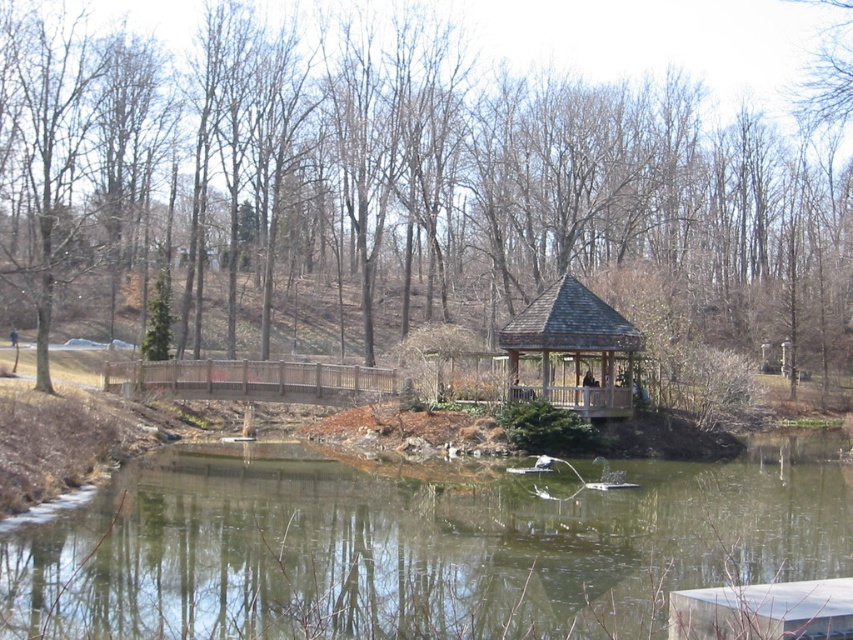
You are standing at the edge of the pond and want to take a photo of the green leafy tree at center. Based on its 2D location, where should you position yourself to capture the tree in the center of your camera frame?

The green leafy tree at center is located at point 0.292 on the x axis and 0.471 on the y axis, so you should position yourself at the edge of the pond facing towards the coordinates (401, 186) to center the tree in your camera frame.

You are planning to take a photo of both the green leafy tree at center and the wooden gazebo at center from a distance. Which object will appear wider in the photo?

The green leafy tree at center will appear wider in the photo because its width surpasses that of the wooden gazebo at center.

You are planning to build a small boat that can float on the greenish reflective water at center. Considering the size of the water body, will the wooden gazebo at center interfere with the boat navigation?

The greenish reflective water at center is larger in size than the wooden gazebo at center, so there should be enough space for the boat to navigate without interference from the gazebo.